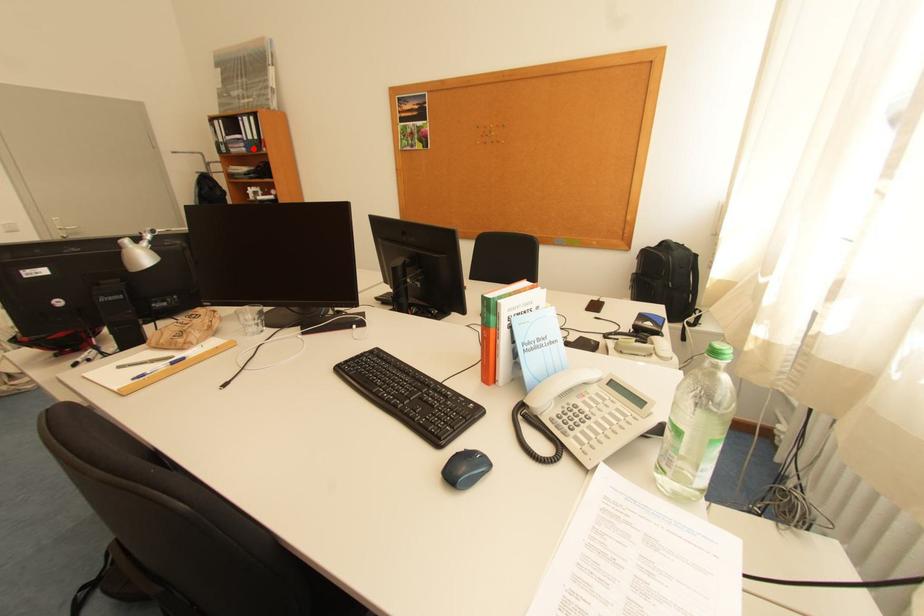
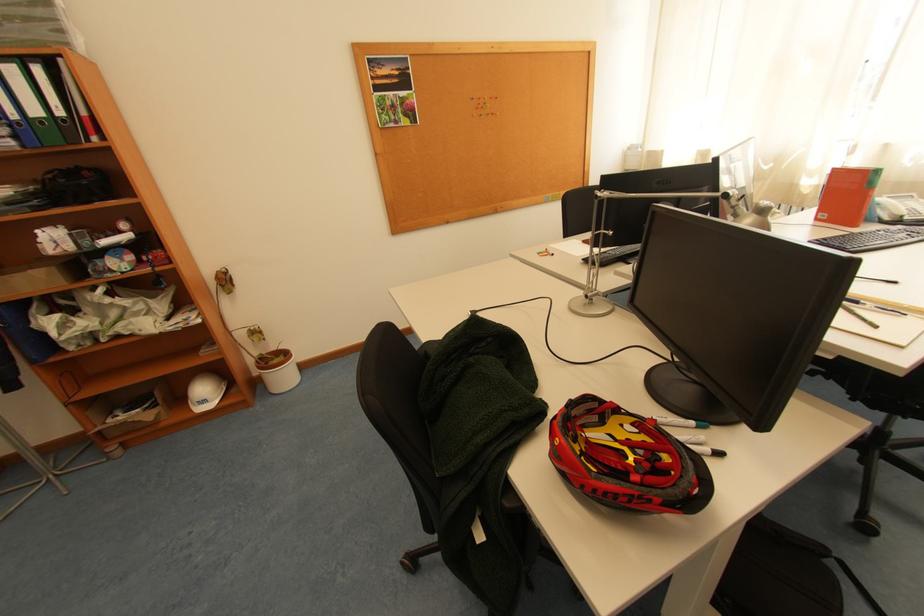
Where in the second image is the point corresponding to the highlighted location from the first image?

(23, 139)